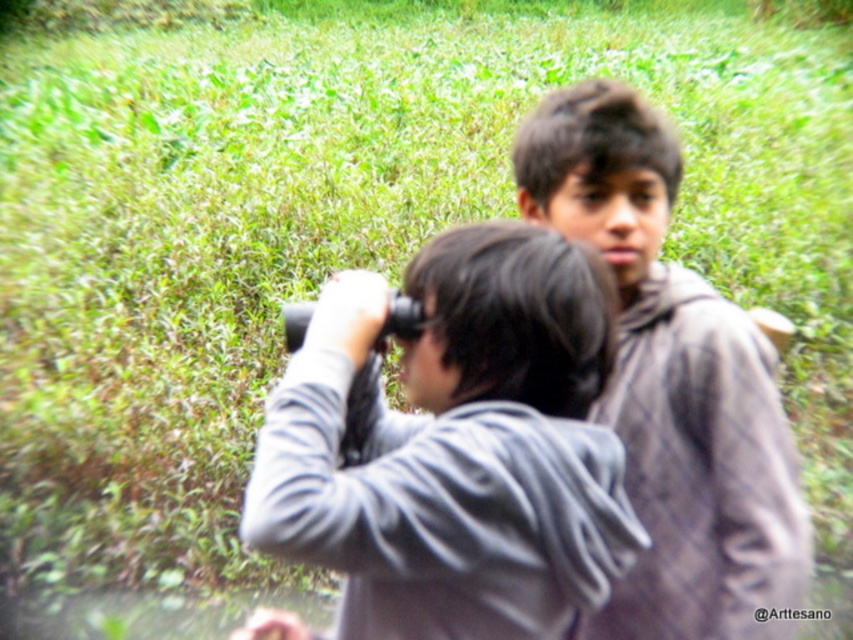
You are trying to determine which gray garment is closer to you in the image. Both the gray matte jacket at center and the gray woolen sweater at center are visible. Which one is positioned closer to the observer?

The gray matte jacket at center is positioned closer to the observer because it is in front of the gray woolen sweater at center.

You are standing at the point marked as point (456, 445) in the image. What object is located exactly at that point?

The gray matte jacket at center is located exactly at point (456, 445).

You are trying to determine which of the two gray clothing items in the scene is shorter. The gray matte jacket at center and the gray woolen sweater at center are both in your view. Which one is shorter?

The gray matte jacket at center is shorter than the gray woolen sweater at center.